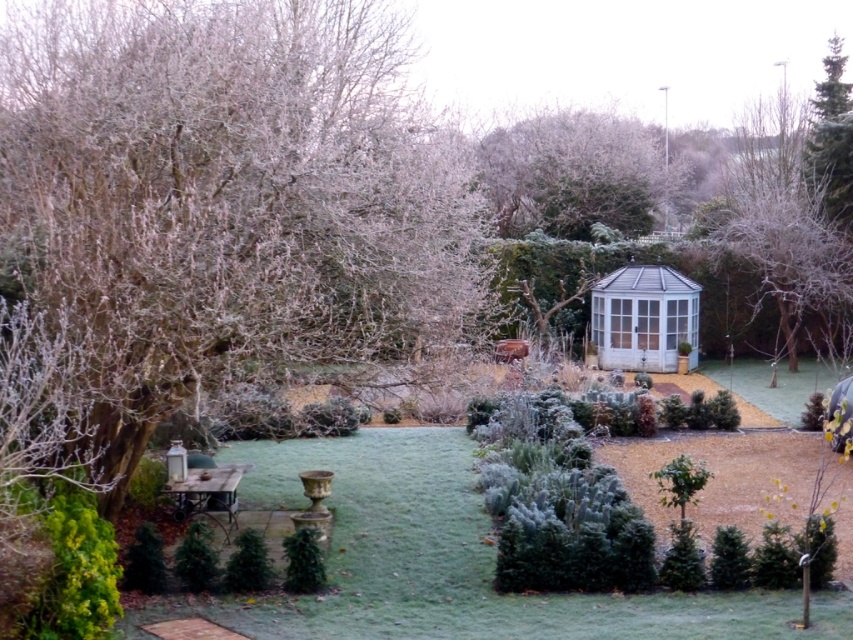
Question: Among these points, which one is nearest to the camera?

Choices:
 (A) (643, 163)
 (B) (850, 212)
 (C) (213, 250)

Answer: (C)

Question: In this image, where is green textured evergreen tree at upper right located relative to green matte bush at center?

Choices:
 (A) below
 (B) above

Answer: (B)

Question: Can you confirm if frosted bark tree at left is thinner than green textured bush at lower center?

Choices:
 (A) yes
 (B) no

Answer: (B)

Question: Is frosted bark tree at left closer to the viewer compared to green textured evergreen tree at upper right?

Choices:
 (A) yes
 (B) no

Answer: (A)

Question: Which object is the farthest from the green matte bush at center?

Choices:
 (A) frosted green tree at upper center
 (B) frosted bark tree at left

Answer: (A)

Question: Estimate the real-world distances between objects in this image. Which object is closer to the green textured bush at lower center?

Choices:
 (A) frosted bark tree at left
 (B) green textured evergreen tree at upper right
 (C) frosted green tree at upper center
 (D) green matte bush at center

Answer: (D)